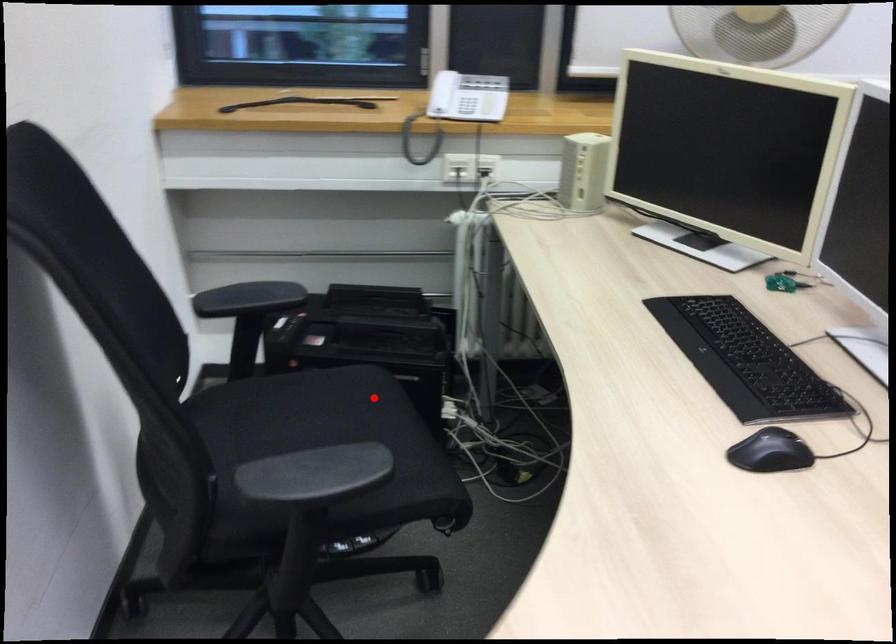
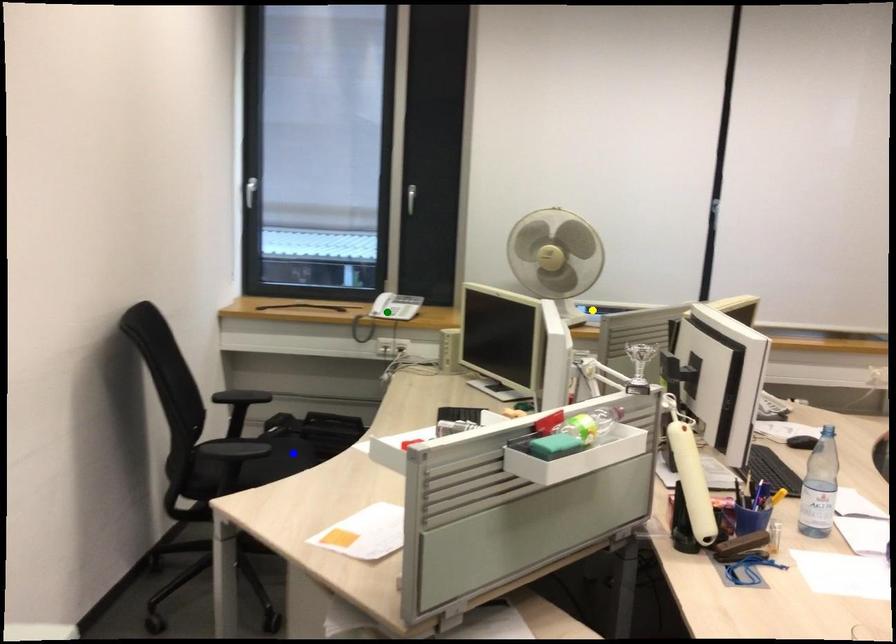
Question: I am providing you with two images of the same scene from different viewpoints. A red point is marked on the first image. You are given multiple points on the second image. Which point in image 2 is actually the same real-world point as the red point in image 1?

Choices:
 (A) yellow point
 (B) green point
 (C) blue point

Answer: (C)